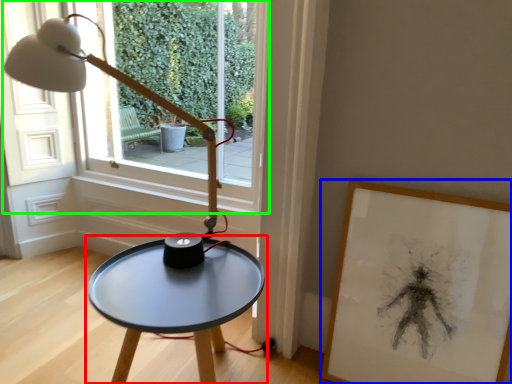
Question: Which object is the closest to the table (highlighted by a red box)? Choose among these: picture frame (highlighted by a blue box) or window (highlighted by a green box).

Choices:
 (A) picture frame
 (B) window

Answer: (A)